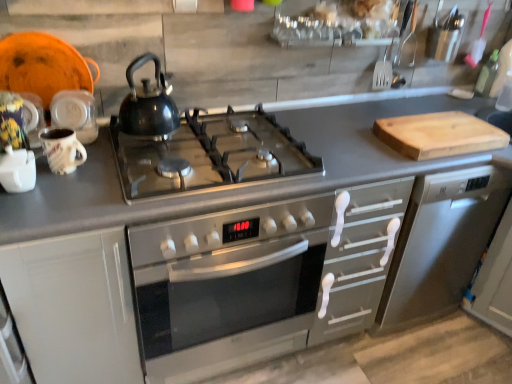
Where is `free spot to the right of matte ceramic mug at left`? This screenshot has width=512, height=384. free spot to the right of matte ceramic mug at left is located at coordinates (100, 180).